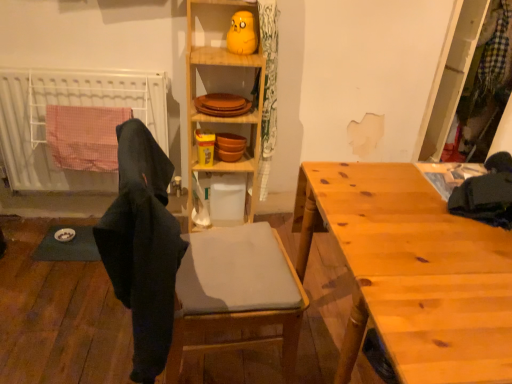
Identify the location of free region on the left part of matte gray cushioned chair at center. Image resolution: width=512 pixels, height=384 pixels. (89, 337).